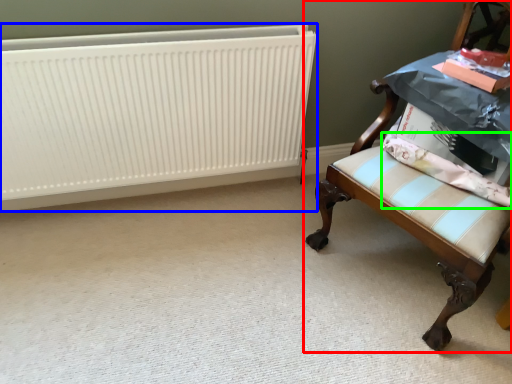
Question: Based on their relative distances, which object is nearer to chair (highlighted by a red box)? Choose from radiator (highlighted by a blue box) and fabric (highlighted by a green box).

Choices:
 (A) radiator
 (B) fabric

Answer: (B)